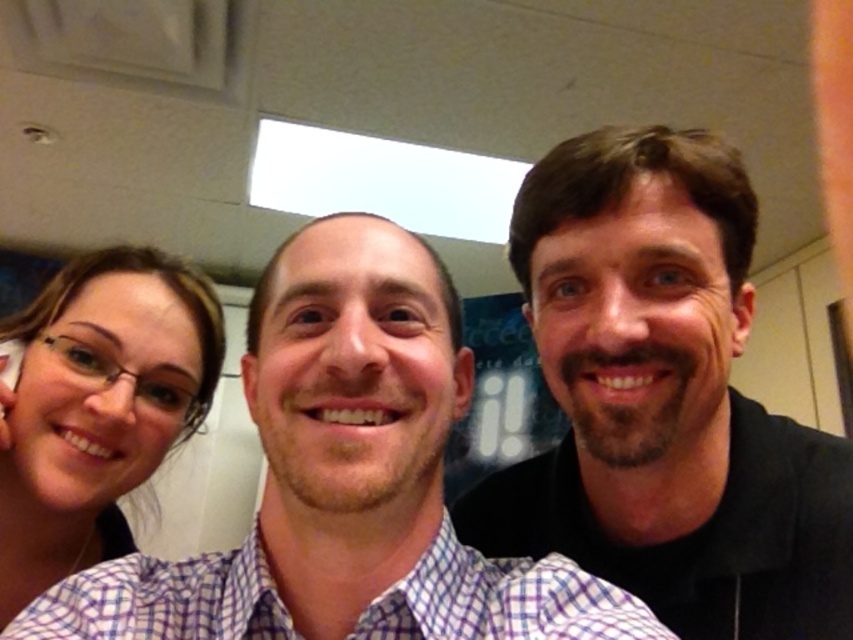
Question: Among these points, which one is farthest from the camera?

Choices:
 (A) (80, 417)
 (B) (825, 611)

Answer: (B)

Question: Does smooth black shirt at right lie in front of matte purple shirt at left?

Choices:
 (A) no
 (B) yes

Answer: (B)

Question: Can you confirm if smooth black shirt at right is thinner than matte purple shirt at left?

Choices:
 (A) yes
 (B) no

Answer: (B)

Question: Which point is farther to the camera?

Choices:
 (A) smooth black shirt at right
 (B) matte purple shirt at left

Answer: (B)

Question: Observing the image, what is the correct spatial positioning of smooth black shirt at right in reference to matte purple shirt at left?

Choices:
 (A) right
 (B) left

Answer: (A)